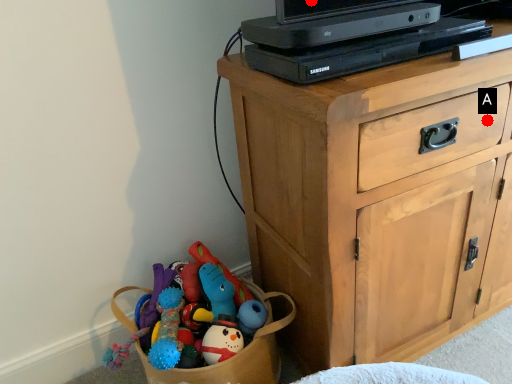
Question: Two points are circled on the image, labeled by A and B beside each circle. Which point appears farthest from the camera in this image?

Choices:
 (A) A is further
 (B) B is further

Answer: (A)